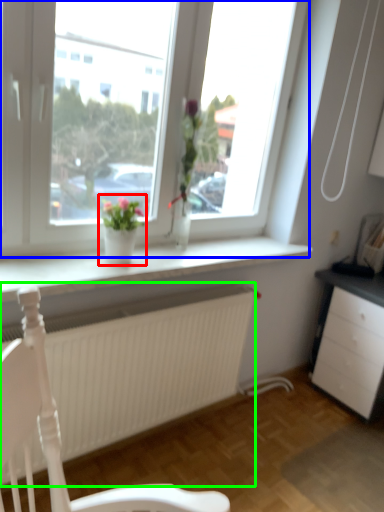
Question: Which object is positioned farthest from houseplant (highlighted by a red box)? Select from window (highlighted by a blue box) and carpets (highlighted by a green box).

Choices:
 (A) window
 (B) carpets

Answer: (B)